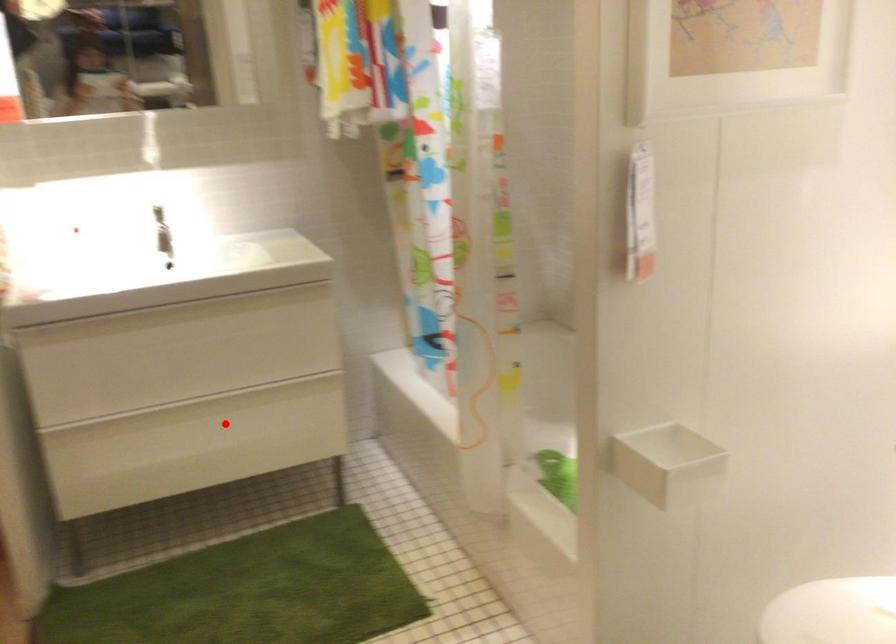
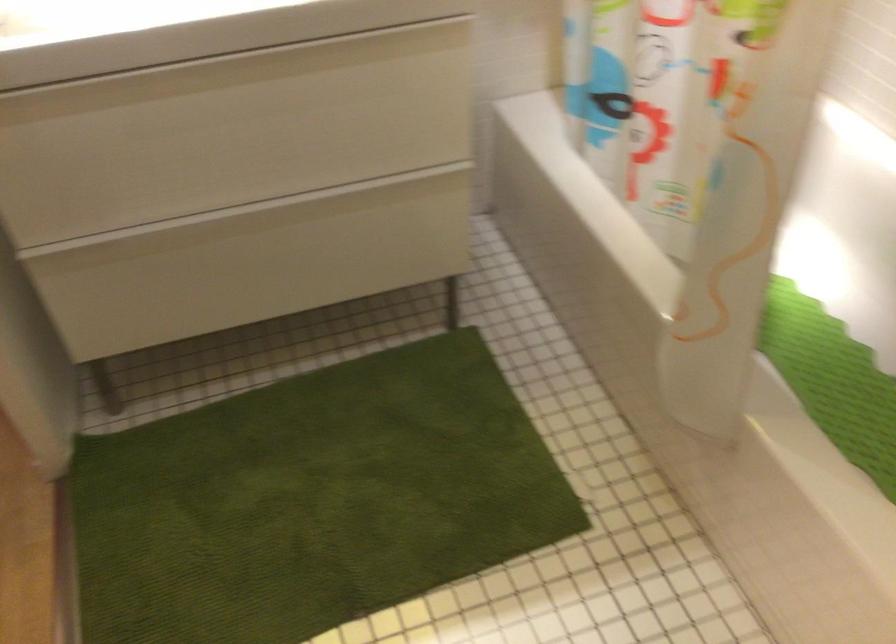
The point at the highlighted location is marked in the first image. Where is the corresponding point in the second image?

(289, 238)